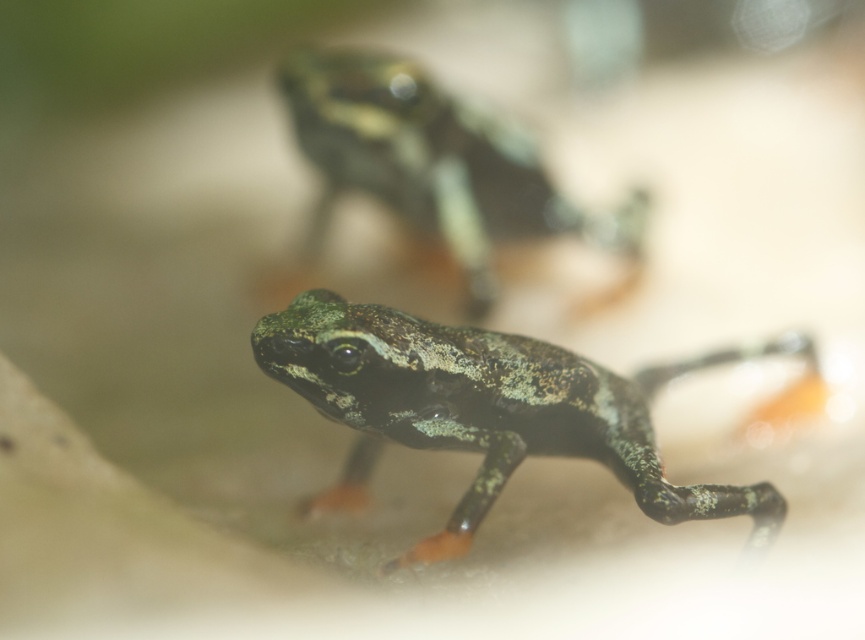
You are a photographer trying to capture a clear image of both the speckled green frog at center and the speckled green skin at center. Based on their positions, which one is easier to focus on?

The speckled green frog at center is closer to the viewer than the speckled green skin at center, so it is easier to focus on.

You are a photographer using a camera with a 100mm lens. You want to capture both the speckled green frog at center and the speckled green skin at center in focus. Given that the depth of field at this lens setting allows for sharp focus within a 15 inch range, will both subjects be in focus?

The speckled green frog at center and the speckled green skin at center are 14.92 inches apart from each other. Since the depth of field allows for sharp focus within a 15 inch range, both subjects will be in focus.

You are a wildlife photographer aiming to capture a closeup of both the speckled green frog at center and the speckled green skin at center. Given that your camera can only focus on one subject at a time, which frog should you adjust your focus to first if you want to ensure the larger frog is sharp?

The speckled green frog at center is larger than the speckled green skin at center. Therefore, you should adjust your focus to the speckled green frog at center first to ensure its sharpness since it requires more detailed focus due to its larger size.